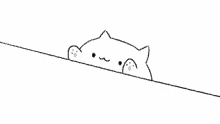
Locate an element on the screen. The image size is (220, 124). table is located at coordinates (69, 108).